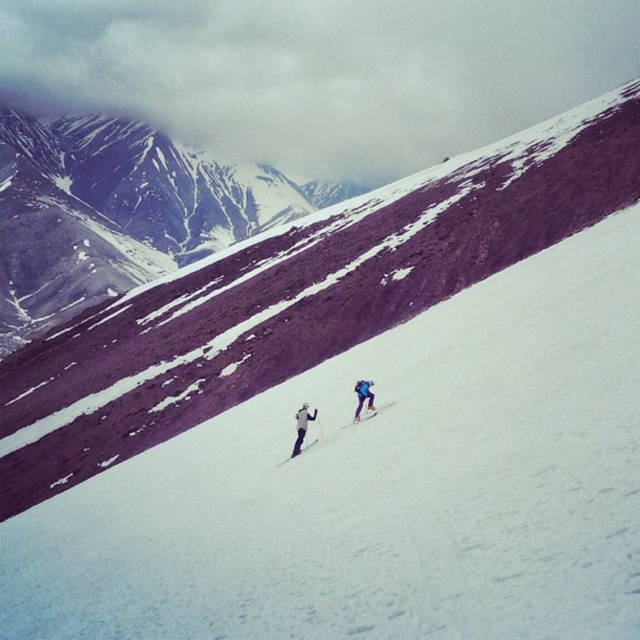
Is white matte skier at center bigger than white matte ski at center?

Yes.

Which of these two, white matte skier at center or white matte ski at center, stands shorter?

Result: Standing shorter between the two is white matte ski at center.

Between point (308, 412) and point (301, 448), which one is positioned in front?

Point (301, 448)

Find the location of a particular element. This screenshot has height=640, width=640. white matte skier at center is located at coordinates (301, 426).

Is point (355, 381) positioned after point (296, 452)?

Yes, point (355, 381) is behind point (296, 452).

Does point (356, 380) lie behind point (305, 451)?

That is True.

The height and width of the screenshot is (640, 640). I want to click on blue fabric skier at center, so click(x=362, y=396).

Can you confirm if white snow at center is thinner than white matte ski at center?

In fact, white snow at center might be wider than white matte ski at center.

Is white snow at center bigger than white matte ski at center?

Yes, white snow at center is bigger than white matte ski at center.

Does point (474, 500) lie behind point (300, 449)?

No, (474, 500) is closer to viewer.

This screenshot has height=640, width=640. I want to click on white snow at center, so click(381, 486).